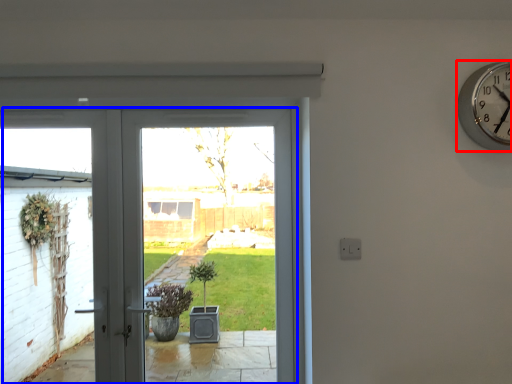
Question: Which object is closer to the camera taking this photo, wall clock (highlighted by a red box) or door (highlighted by a blue box)?

Choices:
 (A) wall clock
 (B) door

Answer: (A)